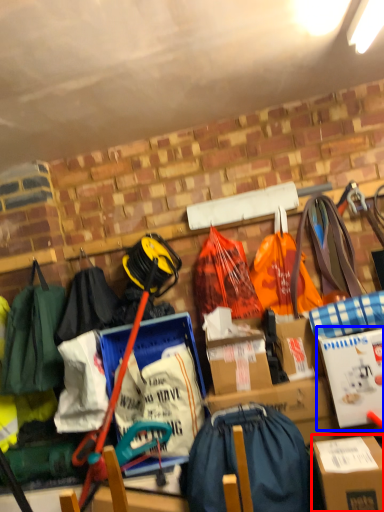
Question: Which object appears closest to the camera in this image, box (highlighted by a red box) or cardboard box (highlighted by a blue box)?

Choices:
 (A) box
 (B) cardboard box

Answer: (A)